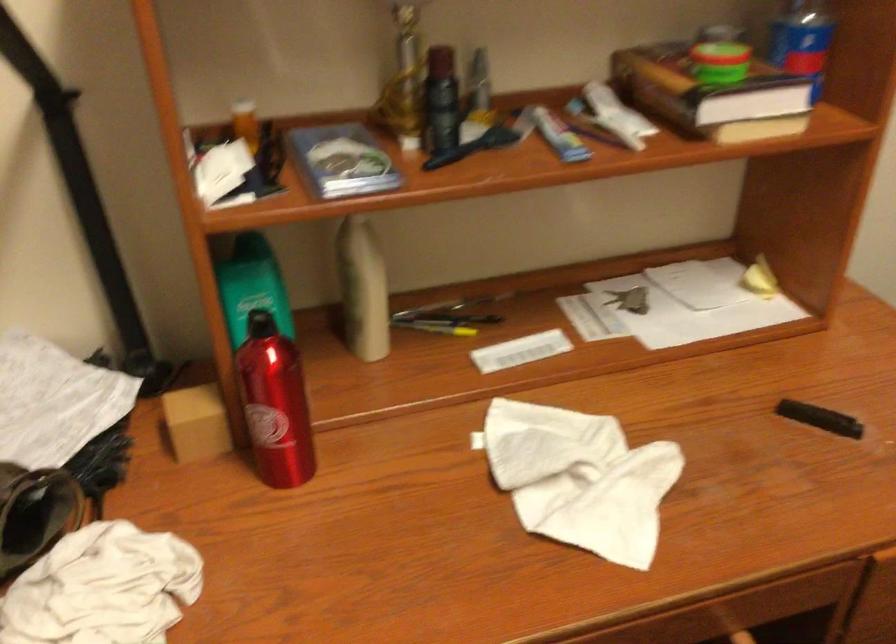
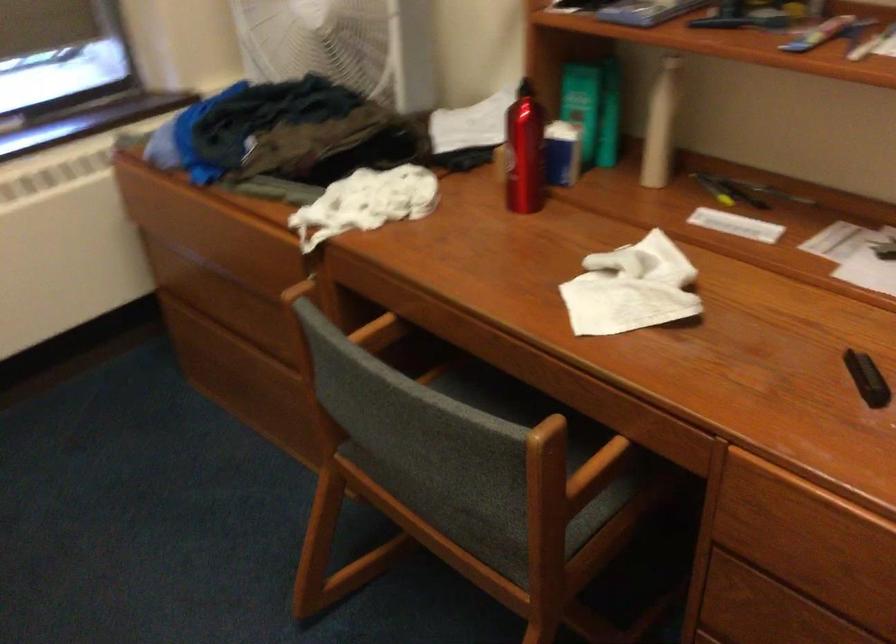
Locate, in the second image, the point that corresponds to point (382, 292) in the first image.

(659, 125)